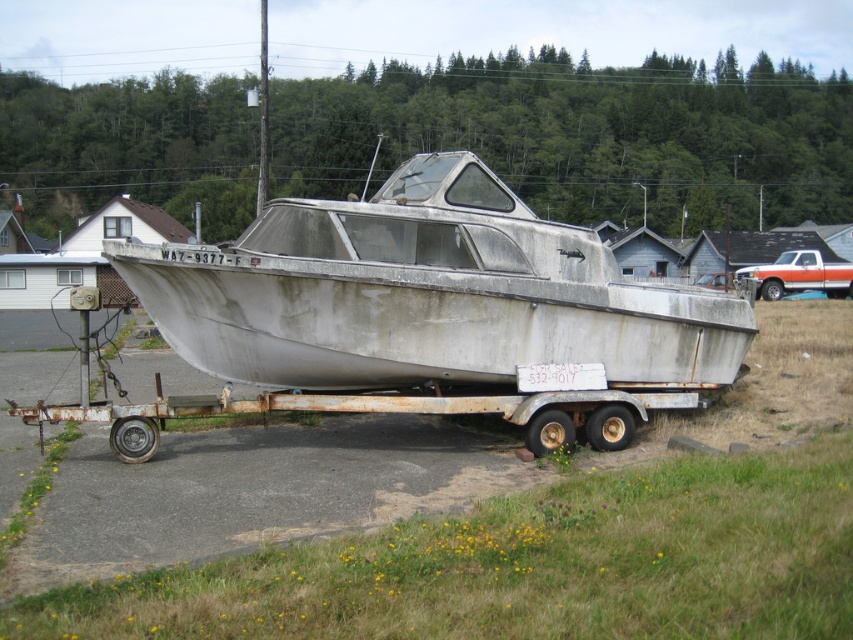
Does rusty aluminum boat at center have a greater width compared to rusty metal trailer at center?

Indeed, rusty aluminum boat at center has a greater width compared to rusty metal trailer at center.

Is point (425, 212) more distant than point (292, 396)?

No, (425, 212) is closer to viewer.

The width and height of the screenshot is (853, 640). What do you see at coordinates (426, 296) in the screenshot?
I see `rusty aluminum boat at center` at bounding box center [426, 296].

I want to click on rusty aluminum boat at center, so click(426, 296).